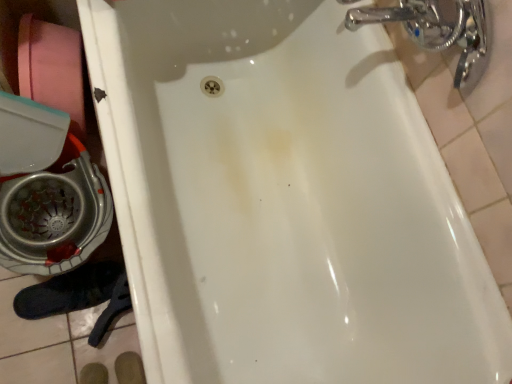
Question: Considering the relative sizes of pink cardboard toilet paper at left and chrome metallic faucet at upper right in the image provided, is pink cardboard toilet paper at left smaller than chrome metallic faucet at upper right?

Choices:
 (A) yes
 (B) no

Answer: (B)

Question: Is pink cardboard toilet paper at left at the right side of chrome metallic faucet at upper right?

Choices:
 (A) yes
 (B) no

Answer: (B)

Question: From the image's perspective, is pink cardboard toilet paper at left located beneath chrome metallic faucet at upper right?

Choices:
 (A) no
 (B) yes

Answer: (B)

Question: Considering the relative positions of pink cardboard toilet paper at left and chrome metallic faucet at upper right in the image provided, is pink cardboard toilet paper at left in front of chrome metallic faucet at upper right?

Choices:
 (A) yes
 (B) no

Answer: (B)

Question: Can you confirm if pink cardboard toilet paper at left is thinner than chrome metallic faucet at upper right?

Choices:
 (A) no
 (B) yes

Answer: (B)

Question: Visually, is black suede shoe at lower left positioned to the left or to the right of pink cardboard toilet paper at left?

Choices:
 (A) right
 (B) left

Answer: (A)

Question: In the image, is black suede shoe at lower left positioned in front of or behind pink cardboard toilet paper at left?

Choices:
 (A) behind
 (B) front

Answer: (A)

Question: Does point (41, 294) appear closer or farther from the camera than point (58, 33)?

Choices:
 (A) farther
 (B) closer

Answer: (A)

Question: From the image's perspective, is black suede shoe at lower left above or below pink cardboard toilet paper at left?

Choices:
 (A) above
 (B) below

Answer: (B)

Question: Is chrome metallic faucet at upper right inside or outside of pink cardboard toilet paper at left?

Choices:
 (A) outside
 (B) inside

Answer: (A)

Question: From a real-world perspective, is chrome metallic faucet at upper right positioned above or below pink cardboard toilet paper at left?

Choices:
 (A) below
 (B) above

Answer: (B)

Question: Looking at the image, does chrome metallic faucet at upper right seem bigger or smaller compared to pink cardboard toilet paper at left?

Choices:
 (A) small
 (B) big

Answer: (A)

Question: From the image's perspective, relative to pink cardboard toilet paper at left, is chrome metallic faucet at upper right above or below?

Choices:
 (A) below
 (B) above

Answer: (B)

Question: In terms of height, does pink cardboard toilet paper at left look taller or shorter compared to black suede shoe at lower left?

Choices:
 (A) tall
 (B) short

Answer: (A)

Question: Looking at their shapes, would you say pink cardboard toilet paper at left is wider or thinner than black suede shoe at lower left?

Choices:
 (A) wide
 (B) thin

Answer: (B)